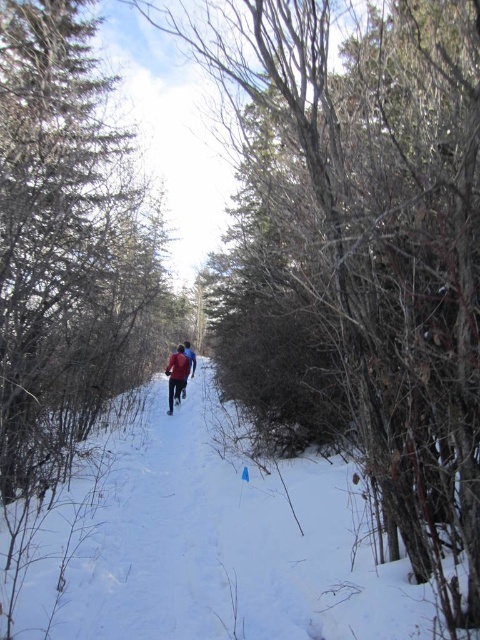
Question: Among these points, which one is farthest from the camera?

Choices:
 (A) (19, 387)
 (B) (81, 636)

Answer: (A)

Question: Which point is farther from the camera taking this photo?

Choices:
 (A) (172, 371)
 (B) (24, 68)
 (C) (190, 584)

Answer: (A)

Question: Does white powdery snow at center appear on the left side of red fabric jacket at center?

Choices:
 (A) no
 (B) yes

Answer: (B)

Question: Does brown textured tree at center have a larger size compared to red fabric jacket at center?

Choices:
 (A) no
 (B) yes

Answer: (B)

Question: Does white powdery snow at center have a lesser width compared to brown textured tree at center?

Choices:
 (A) yes
 (B) no

Answer: (A)

Question: Estimate the real-world distances between objects in this image. Which object is closer to the brown textured tree at center?

Choices:
 (A) white powdery snow at center
 (B) red fabric jacket at center

Answer: (A)